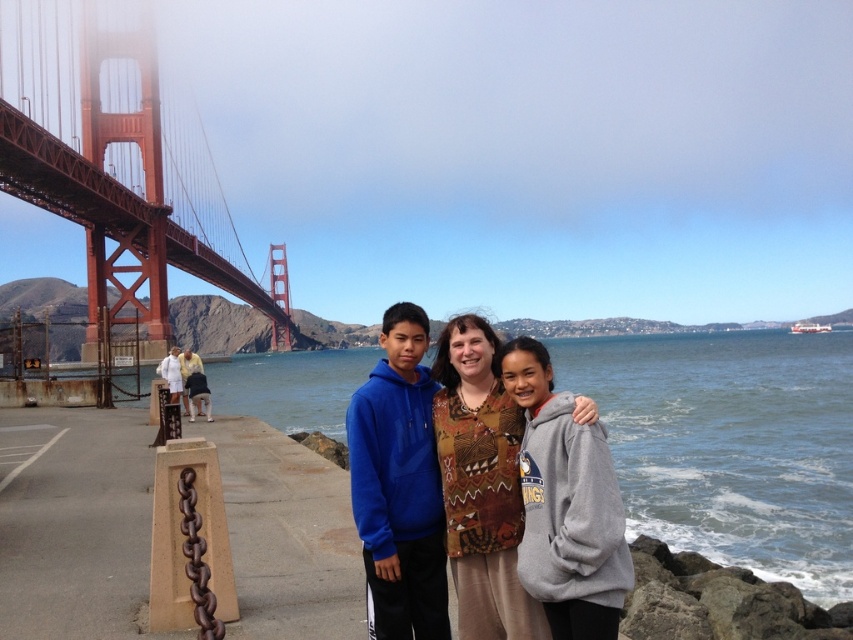
Can you confirm if red painted steel golden gate bridge at left is wider than white cotton shirt at left?

Correct, the width of red painted steel golden gate bridge at left exceeds that of white cotton shirt at left.

Can you confirm if red painted steel golden gate bridge at left is smaller than white cotton shirt at left?

No, red painted steel golden gate bridge at left is not smaller than white cotton shirt at left.

Find the location of a particular element. red painted steel golden gate bridge at left is located at coordinates 115,163.

Between blue water at center and white cotton shirt at left, which one is positioned higher?

white cotton shirt at left is higher up.

Is the position of blue water at center more distant than that of white cotton shirt at left?

That is False.

Who is more forward, (218, 404) or (178, 360)?

Point (178, 360) is more forward.

Locate an element on the screen. The height and width of the screenshot is (640, 853). blue water at center is located at coordinates [730, 444].

Between red painted steel golden gate bridge at left and brown textured blouse at center, which one appears on the left side from the viewer's perspective?

From the viewer's perspective, red painted steel golden gate bridge at left appears more on the left side.

Does red painted steel golden gate bridge at left appear over brown textured blouse at center?

Correct, red painted steel golden gate bridge at left is located above brown textured blouse at center.

This screenshot has width=853, height=640. I want to click on red painted steel golden gate bridge at left, so click(x=115, y=163).

This screenshot has width=853, height=640. Identify the location of red painted steel golden gate bridge at left. (115, 163).